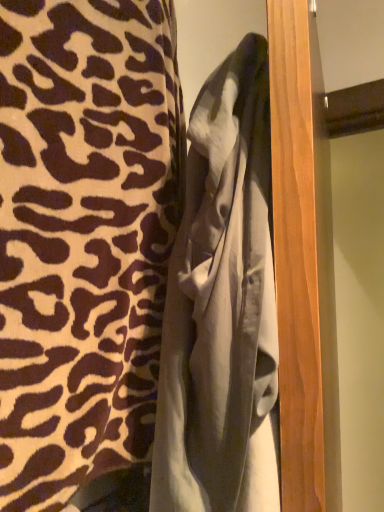
Question: Considering the relative positions of leopard print fabric at center and gray cotton bathrobe at center in the image provided, is leopard print fabric at center to the left of gray cotton bathrobe at center from the viewer's perspective?

Choices:
 (A) yes
 (B) no

Answer: (A)

Question: Could you tell me if leopard print fabric at center is turned towards gray cotton bathrobe at center?

Choices:
 (A) no
 (B) yes

Answer: (B)

Question: Is leopard print fabric at center looking in the opposite direction of gray cotton bathrobe at center?

Choices:
 (A) yes
 (B) no

Answer: (A)

Question: Can you confirm if leopard print fabric at center is shorter than gray cotton bathrobe at center?

Choices:
 (A) yes
 (B) no

Answer: (B)

Question: From a real-world perspective, is leopard print fabric at center located higher than gray cotton bathrobe at center?

Choices:
 (A) yes
 (B) no

Answer: (A)

Question: From a real-world perspective, is leopard print fabric at center below gray cotton bathrobe at center?

Choices:
 (A) yes
 (B) no

Answer: (B)

Question: Are gray cotton bathrobe at center and leopard print fabric at center beside each other?

Choices:
 (A) yes
 (B) no

Answer: (B)

Question: Is gray cotton bathrobe at center at the left side of leopard print fabric at center?

Choices:
 (A) yes
 (B) no

Answer: (B)

Question: Considering the relative sizes of gray cotton bathrobe at center and leopard print fabric at center in the image provided, is gray cotton bathrobe at center thinner than leopard print fabric at center?

Choices:
 (A) no
 (B) yes

Answer: (B)

Question: Would you say gray cotton bathrobe at center contains leopard print fabric at center?

Choices:
 (A) yes
 (B) no

Answer: (B)

Question: Is gray cotton bathrobe at center positioned with its back to leopard print fabric at center?

Choices:
 (A) no
 (B) yes

Answer: (B)

Question: Is gray cotton bathrobe at center far from leopard print fabric at center?

Choices:
 (A) yes
 (B) no

Answer: (B)

Question: Considering the positions of leopard print fabric at center and gray cotton bathrobe at center in the image, is leopard print fabric at center wider or thinner than gray cotton bathrobe at center?

Choices:
 (A) thin
 (B) wide

Answer: (B)